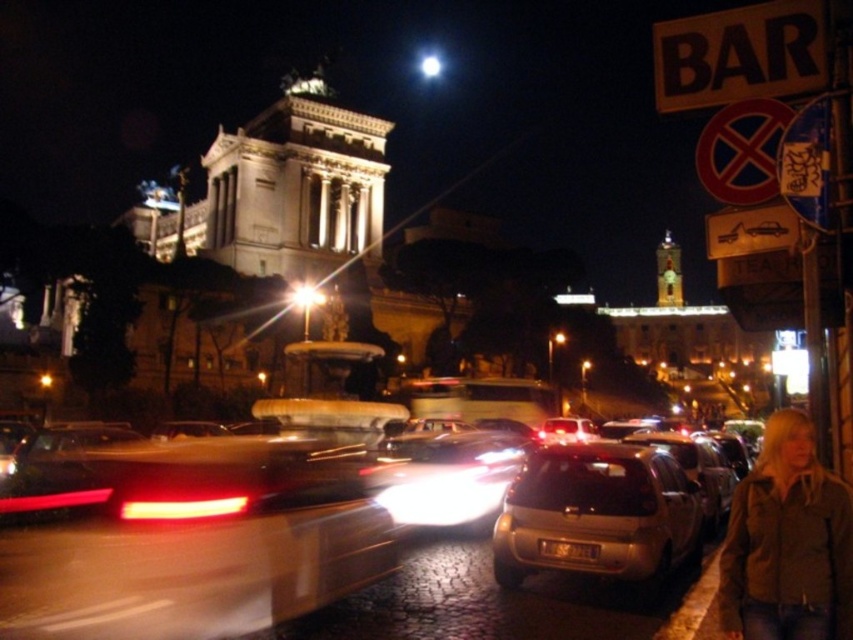
Question: Does satin gold car at lower right have a larger size compared to brown leather jacket at lower right?

Choices:
 (A) no
 (B) yes

Answer: (B)

Question: Which point is closer to the camera taking this photo?

Choices:
 (A) (660, 525)
 (B) (544, 602)
 (C) (756, 561)

Answer: (C)

Question: Which point is farther to the camera?

Choices:
 (A) (x=582, y=556)
 (B) (x=532, y=624)

Answer: (A)

Question: Among these points, which one is farthest from the camera?

Choices:
 (A) (467, 627)
 (B) (645, 572)
 (C) (706, 28)

Answer: (C)

Question: Does brown leather jacket at lower right have a greater width compared to metallic silver car at center?

Choices:
 (A) yes
 (B) no

Answer: (B)

Question: Observing the image, what is the correct spatial positioning of brown leather jacket at lower right in reference to black plastic sign at upper right?

Choices:
 (A) above
 (B) below

Answer: (B)